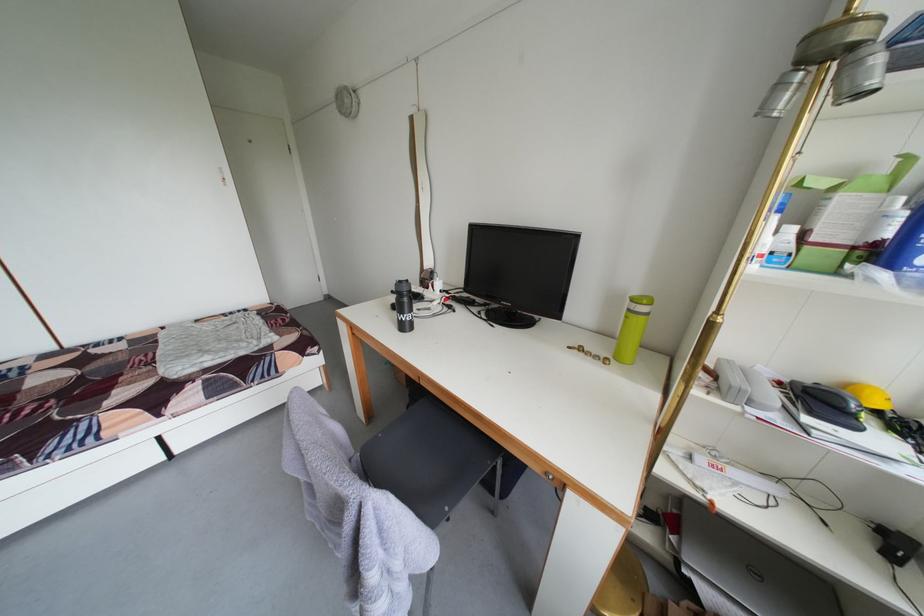
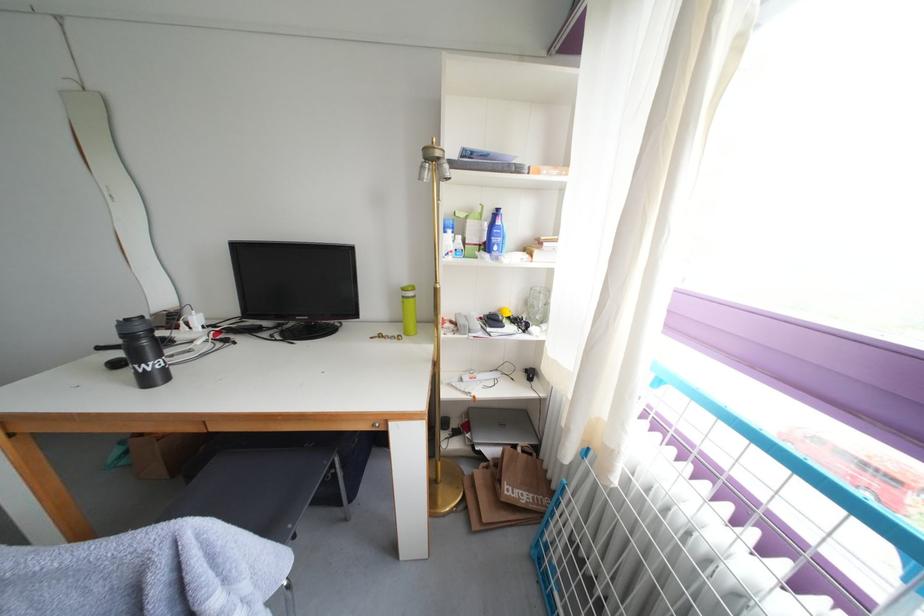
Find the pixel in the second image that matches the point at 385,515 in the first image.

(208, 541)